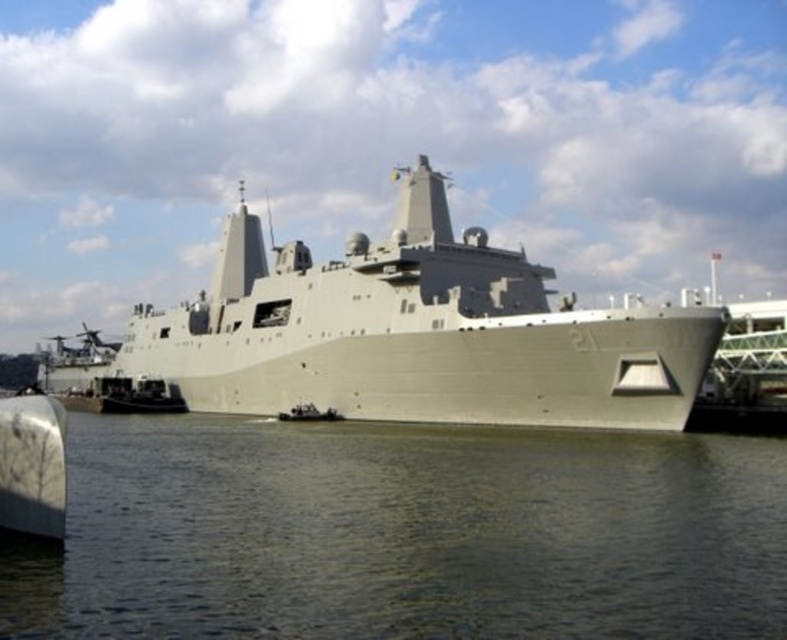
You are standing on the dock and see the gray matte ship at center and the greenish water at lower center. Which object is positioned to the right of the other?

The greenish water at lower center is to the right of the gray matte ship at center.

You are standing on the deck of the ship and looking at two points marked on the ship. The first point is at coordinates point [442,570] and the second point is at point [213,355]. Which point is closer to you?

Point [442,570] is closer to the viewer than point [213,355].